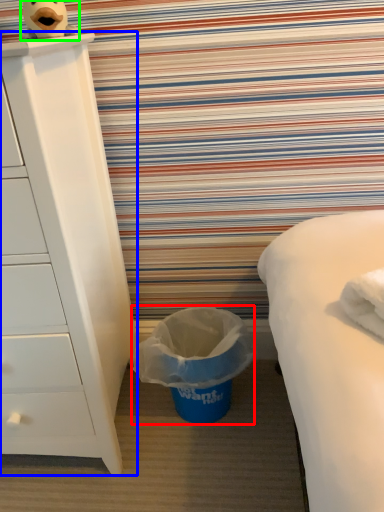
Question: Which object is positioned farthest from garbage (highlighted by a red box)? Select from chest of drawers (highlighted by a blue box) and toy (highlighted by a green box).

Choices:
 (A) chest of drawers
 (B) toy

Answer: (B)